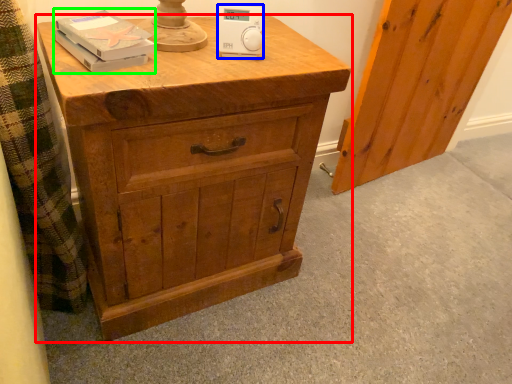
Question: Estimate the real-world distances between objects in this image. Which object is closer to chest of drawers (highlighted by a red box), ipod (highlighted by a blue box) or book (highlighted by a green box)?

Choices:
 (A) ipod
 (B) book

Answer: (B)